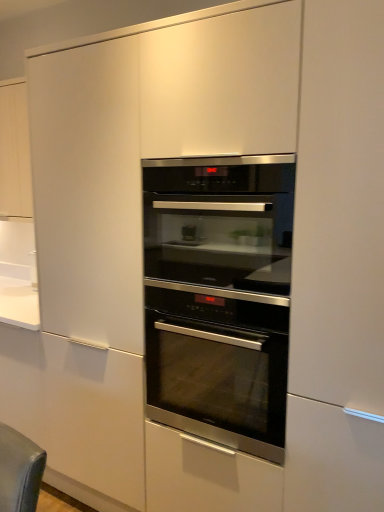
Question: Is stainless steel oven at center, marked as the 2th oven in a top-to-bottom arrangement, to the left or to the right of stainless steel oven at center, positioned as the 2th oven in bottom-to-top order, in the image?

Choices:
 (A) left
 (B) right

Answer: (A)

Question: From a real-world perspective, relative to stainless steel oven at center, which is counted as the 1th oven, starting from the top, is stainless steel oven at center, marked as the 2th oven in a top-to-bottom arrangement, vertically above or below?

Choices:
 (A) below
 (B) above

Answer: (A)

Question: From the image's perspective, relative to stainless steel oven at center, which is counted as the 1th oven, starting from the top, is stainless steel oven at center, marked as the 2th oven in a top-to-bottom arrangement, above or below?

Choices:
 (A) below
 (B) above

Answer: (A)

Question: From the image's perspective, relative to stainless steel oven at center, which ranks as the first oven in bottom-to-top order, is stainless steel oven at center, which is counted as the 1th oven, starting from the top, above or below?

Choices:
 (A) above
 (B) below

Answer: (A)

Question: Which is correct: stainless steel oven at center, positioned as the 2th oven in bottom-to-top order, is inside stainless steel oven at center, marked as the 2th oven in a top-to-bottom arrangement, or outside of it?

Choices:
 (A) outside
 (B) inside

Answer: (A)

Question: From a real-world perspective, is stainless steel oven at center, positioned as the 2th oven in bottom-to-top order, physically located above or below stainless steel oven at center, marked as the 2th oven in a top-to-bottom arrangement?

Choices:
 (A) below
 (B) above

Answer: (B)

Question: Considering the positions of stainless steel oven at center, positioned as the 2th oven in bottom-to-top order, and stainless steel oven at center, which ranks as the first oven in bottom-to-top order, in the image, is stainless steel oven at center, positioned as the 2th oven in bottom-to-top order, bigger or smaller than stainless steel oven at center, which ranks as the first oven in bottom-to-top order,?

Choices:
 (A) big
 (B) small

Answer: (B)